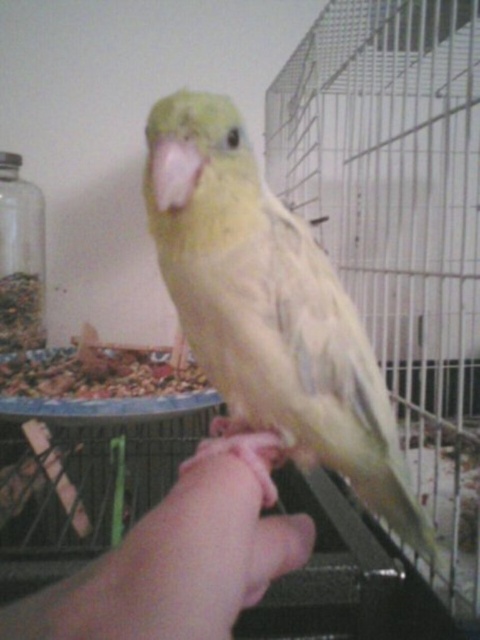
Is point (237, 292) more distant than point (205, 465)?

That is True.

Can you confirm if yellow matte parrot at center is positioned below pink fabric hand at center?

Incorrect, yellow matte parrot at center is not positioned below pink fabric hand at center.

Where is `yellow matte parrot at center`? This screenshot has width=480, height=640. yellow matte parrot at center is located at coordinates (269, 307).